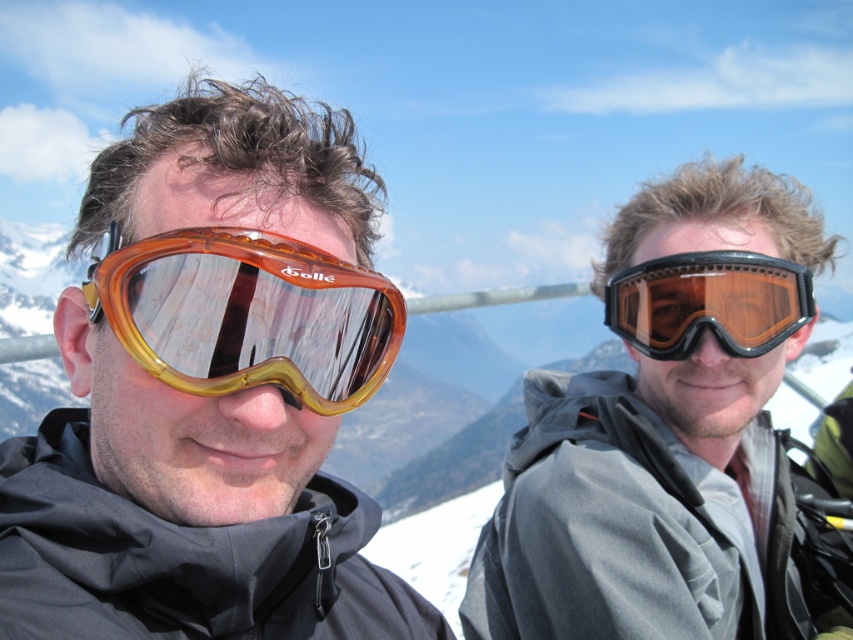
You are planning to buy a pair of goggles for your winter trip. You want to know which of the two pairs in the image has a wider field of view. The options are the orange translucent goggles at center and the matte black goggles at right. Based on their physical dimensions, which one likely offers a wider field of view?

The orange translucent goggles at center has a greater width than the matte black goggles at right, so they likely offer a wider field of view.

You are a photographer trying to capture a closeup of the orange translucent goggles at center without the matte black goggles at right appearing in the frame. Is this possible given their current positions?

The orange translucent goggles at center is positioned over matte black goggles at right, so the photographer cannot capture a closeup of the orange translucent goggles at center without the matte black goggles at right appearing in the frame because they are directly in front of it.

You are standing at the base of the mountain and see both the matte black goggles at center and the translucent amber plastic goggles at left. Which pair of goggles is closer to you?

The matte black goggles at center is closer to you since it is further to the viewer than the translucent amber plastic goggles at left.